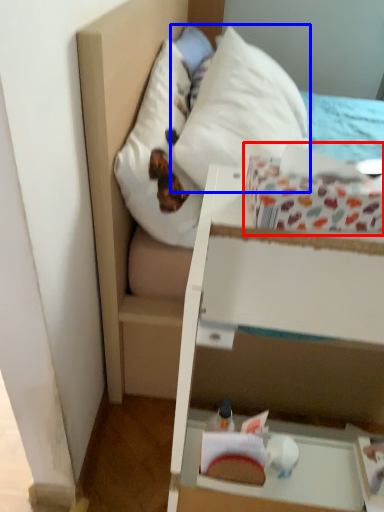
Question: Among these objects, which one is farthest to the camera, cardboard box (highlighted by a red box) or pillow (highlighted by a blue box)?

Choices:
 (A) cardboard box
 (B) pillow

Answer: (B)